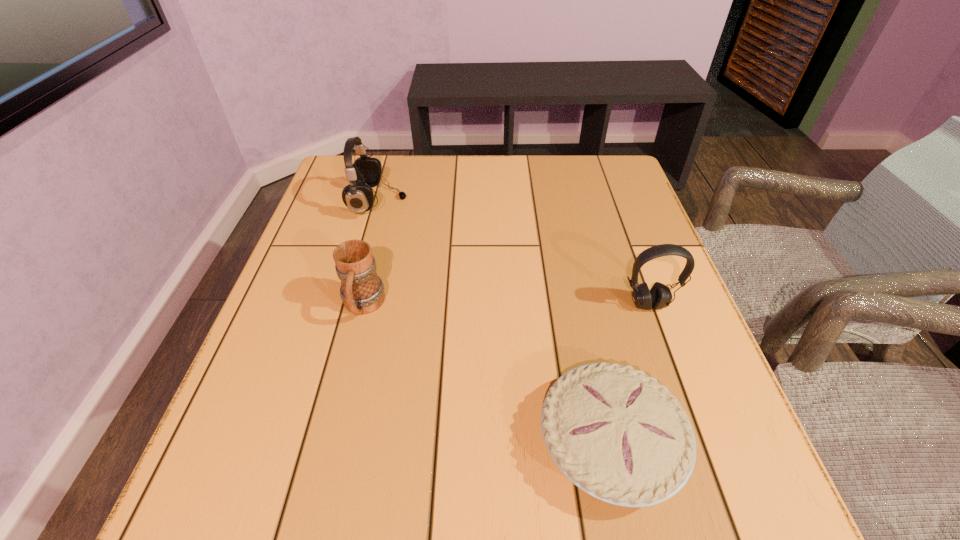
Locate which object ranks second in proximity to the second shortest object. Please provide its 2D coordinates. Your answer should be formatted as a tuple, i.e. [(x, y)], where the tuple contains the x and y coordinates of a point satisfying the conditions above.

[(616, 433)]

Select which object appears as the second closest to the second shortest object. Please provide its 2D coordinates. Your answer should be formatted as a tuple, i.e. [(x, y)], where the tuple contains the x and y coordinates of a point satisfying the conditions above.

[(616, 433)]

Identify the location of free location that satisfies the following two spatial constraints: 1. with the microphone on the side of the farther headset; 2. on the right side of the shortest object. This screenshot has height=540, width=960. (312, 441).

In order to click on vacant point that satisfies the following two spatial constraints: 1. on the side of the shortest object with the handle; 2. on the right side of the mug in this screenshot , I will do `click(329, 441)`.

Locate an element on the screen. This screenshot has height=540, width=960. vacant space that satisfies the following two spatial constraints: 1. with the microphone on the side of the farthest object; 2. on the left side of the shortest object is located at coordinates (312, 441).